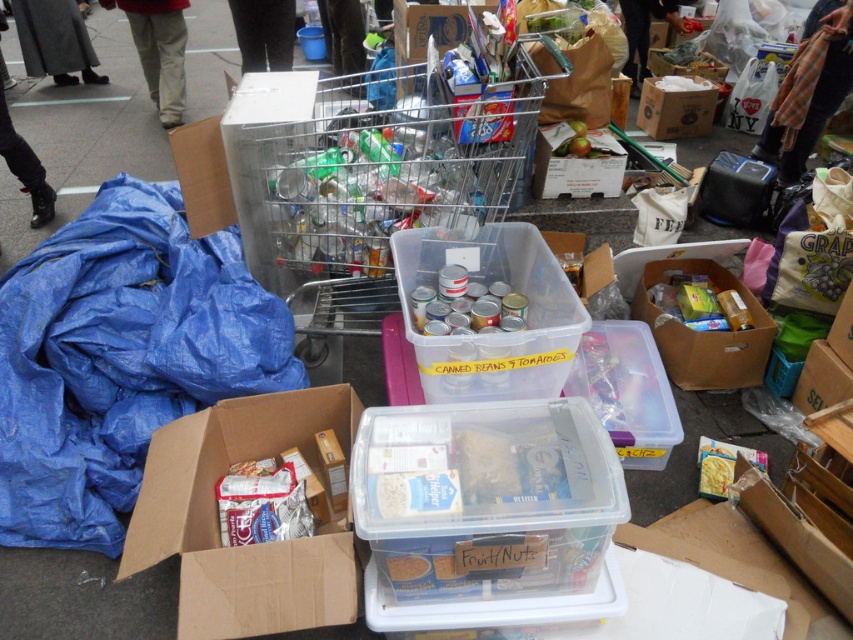
Question: Can you confirm if clear wire shopping cart at center is smaller than brown cardboard box at center-right?

Choices:
 (A) yes
 (B) no

Answer: (B)

Question: Which of these objects is positioned closest to the brown cardboard box at center?

Choices:
 (A) brown cardboard box at center-right
 (B) blue plastic bag at left

Answer: (A)

Question: Estimate the real-world distances between objects in this image. Which object is farther from the brown cardboard box at lower left?

Choices:
 (A) brown cardboard box at center
 (B) clear wire shopping cart at center

Answer: (A)

Question: In this image, where is clear wire shopping cart at center located relative to brown cardboard box at center-right?

Choices:
 (A) left
 (B) right

Answer: (A)

Question: Which of the following is the closest to the observer?

Choices:
 (A) (524, 330)
 (B) (386, 227)

Answer: (A)

Question: Is blue plastic bag at left thinner than transparent plastic container at center?

Choices:
 (A) no
 (B) yes

Answer: (A)